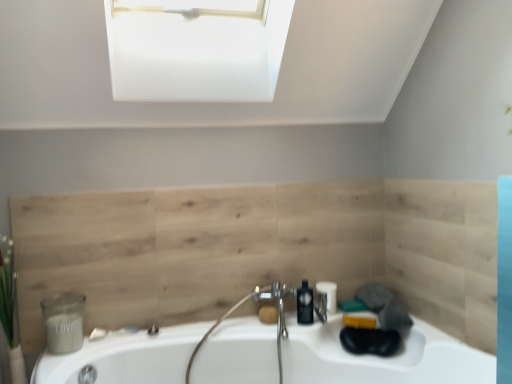
Question: Is natural wood paneling at center closer to camera compared to green leafy plant at left?

Choices:
 (A) yes
 (B) no

Answer: (B)

Question: From the image's perspective, is natural wood paneling at center located beneath green leafy plant at left?

Choices:
 (A) yes
 (B) no

Answer: (B)

Question: Is natural wood paneling at center taller than green leafy plant at left?

Choices:
 (A) yes
 (B) no

Answer: (A)

Question: Does natural wood paneling at center appear on the right side of green leafy plant at left?

Choices:
 (A) yes
 (B) no

Answer: (A)

Question: Is natural wood paneling at center oriented towards green leafy plant at left?

Choices:
 (A) no
 (B) yes

Answer: (B)

Question: Is yellow matte soap at center taller or shorter than black plastic soap dispenser at center?

Choices:
 (A) tall
 (B) short

Answer: (B)

Question: Based on their sizes in the image, would you say yellow matte soap at center is bigger or smaller than black plastic soap dispenser at center?

Choices:
 (A) small
 (B) big

Answer: (A)

Question: From a real-world perspective, relative to black plastic soap dispenser at center, is yellow matte soap at center vertically above or below?

Choices:
 (A) below
 (B) above

Answer: (A)

Question: Is yellow matte soap at center situated inside black plastic soap dispenser at center or outside?

Choices:
 (A) inside
 (B) outside

Answer: (B)

Question: In terms of width, does green leafy plant at left look wider or thinner when compared to black plastic soap dispenser at center?

Choices:
 (A) thin
 (B) wide

Answer: (B)

Question: Looking at the image, does green leafy plant at left seem bigger or smaller compared to black plastic soap dispenser at center?

Choices:
 (A) small
 (B) big

Answer: (B)

Question: Considering their positions, is green leafy plant at left located in front of or behind black plastic soap dispenser at center?

Choices:
 (A) behind
 (B) front

Answer: (B)

Question: Is green leafy plant at left situated inside black plastic soap dispenser at center or outside?

Choices:
 (A) inside
 (B) outside

Answer: (B)

Question: Is matte white candle at lower left wider or thinner than natural wood paneling at center?

Choices:
 (A) thin
 (B) wide

Answer: (B)

Question: Which is correct: matte white candle at lower left is inside natural wood paneling at center, or outside of it?

Choices:
 (A) outside
 (B) inside

Answer: (A)